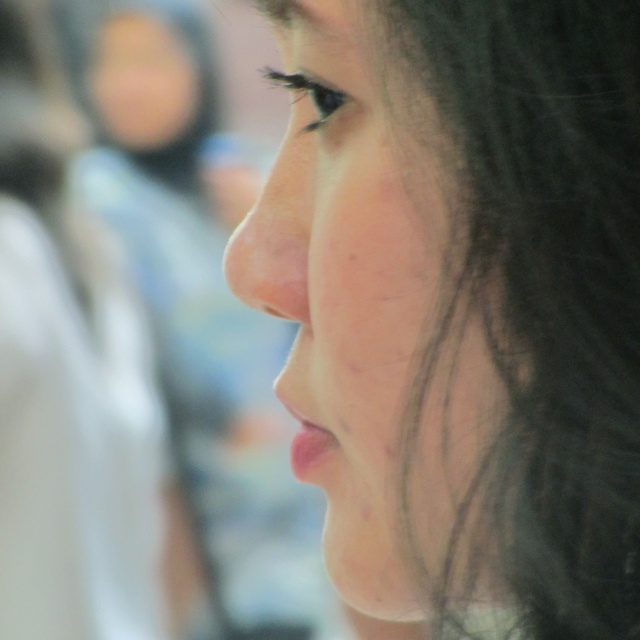
You are a photographer adjusting the focus on a camera. The subject has a smooth skin face at center and a smooth skin nose at center. Which part should you focus on to ensure the face is sharp while keeping the nose slightly out of focus?

You should focus on the smooth skin face at center because it is closer to the viewer than the smooth skin nose at center, so focusing on the face will keep it sharp while the nose may appear slightly out of focus.

You are a photographer adjusting your camera settings to capture the subject in focus. The smooth skin face at center is your main subject. If the depth of field is set to 15 inches, will the background elements remain out of focus?

The smooth skin face at center is 14.84 inches away from the background elements. Since the depth of field is set to 15 inches, the background elements will remain out of focus as they are just within the depth of field range.

You are a photographer adjusting your camera settings to focus on the subject in the image. The focus point is set at point (275, 240). Which part of the face is at this point?

The smooth skin nose at center is located at point (275, 240).